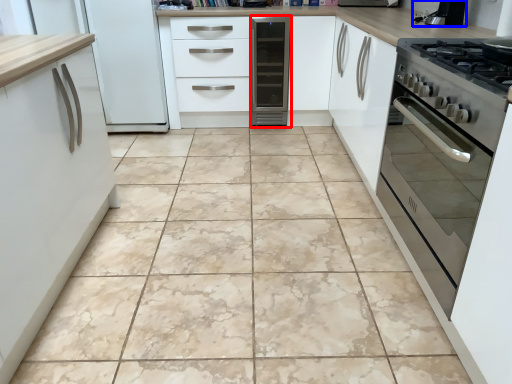
Question: Which object is further to the camera taking this photo, home appliance (highlighted by a red box) or appliance (highlighted by a blue box)?

Choices:
 (A) home appliance
 (B) appliance

Answer: (A)